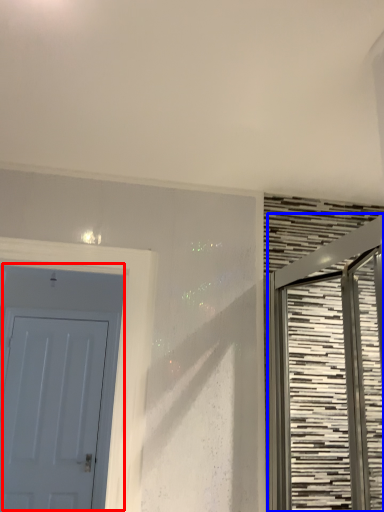
Question: Which point is further to the camera, door (highlighted by a red box) or door (highlighted by a blue box)?

Choices:
 (A) door
 (B) door

Answer: (A)